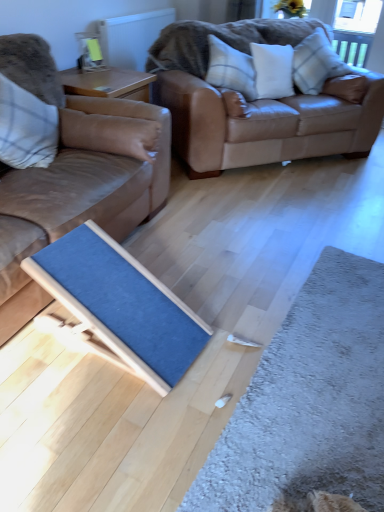
Locate an element on the screen. Image resolution: width=384 pixels, height=512 pixels. vacant space to the right of blue fabric doormat at center, which ranks as the second doormat in right-to-left order is located at coordinates (236, 323).